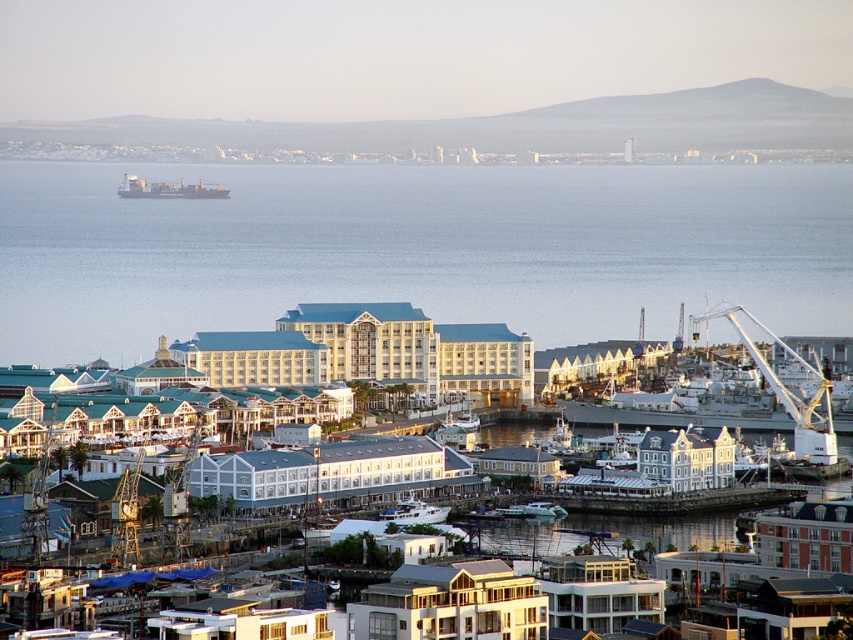
Question: Among these objects, which one is nearest to the camera?

Choices:
 (A) white glossy boat at center
 (B) white glass building at center
 (C) blue water at center

Answer: (C)

Question: Is white glossy building at center bigger than matte gray cargo ship at upper left?

Choices:
 (A) yes
 (B) no

Answer: (A)

Question: Which point is closer to the camera?

Choices:
 (A) (204, 192)
 (B) (595, 618)
 (C) (416, 512)

Answer: (C)

Question: Does blue water at center have a larger size compared to white glossy boat at center?

Choices:
 (A) yes
 (B) no

Answer: (A)

Question: Which object is the farthest from the white glass building at center?

Choices:
 (A) white glossy building at center
 (B) white metallic crane at right
 (C) white glossy boat at center
 (D) blue water at center

Answer: (D)

Question: Is the position of blue water at center more distant than that of matte gray cargo ship at upper left?

Choices:
 (A) yes
 (B) no

Answer: (B)